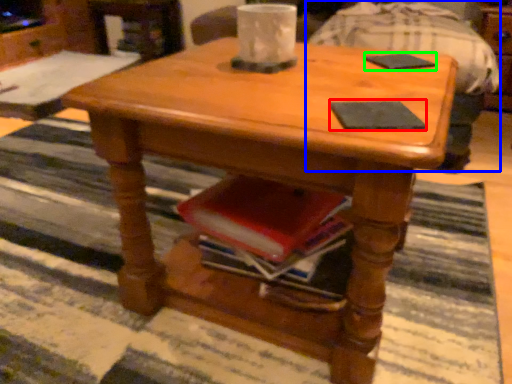
Question: Which object is the farthest from pad (highlighted by a red box)? Choose among these: swivel chair (highlighted by a blue box) or pad (highlighted by a green box).

Choices:
 (A) swivel chair
 (B) pad

Answer: (A)